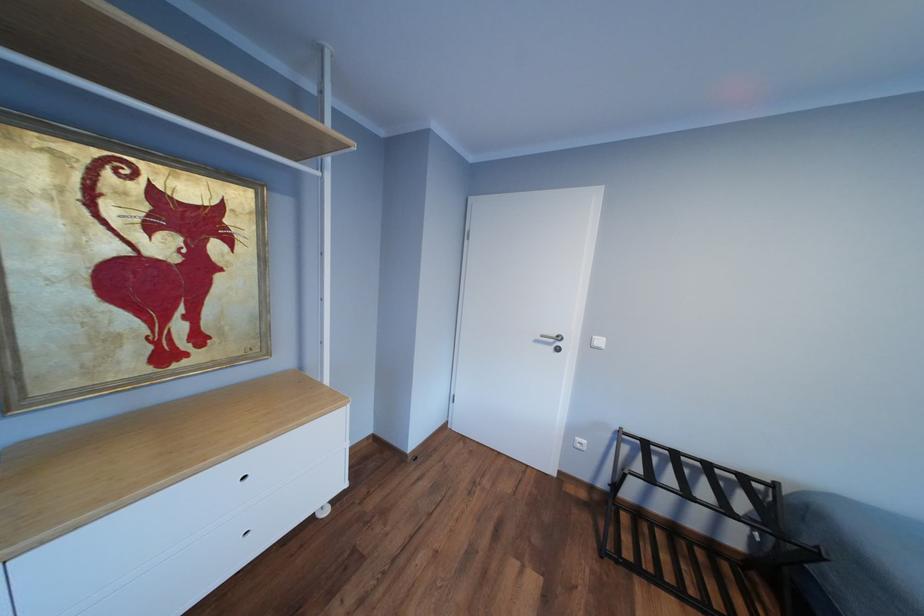
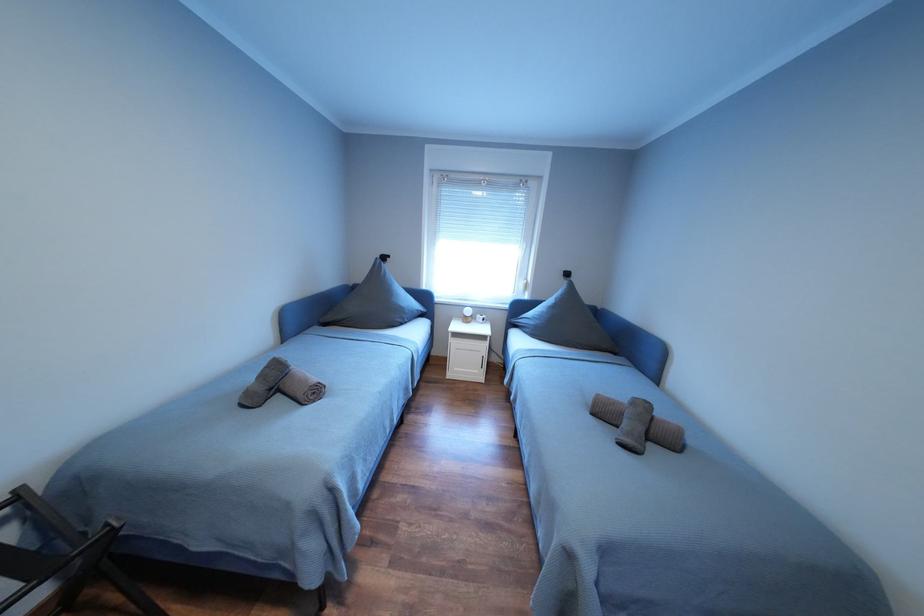
The first image is from the beginning of the video and the second image is from the end. How did the camera likely rotate when shooting the video?

The camera rotated toward right-down.